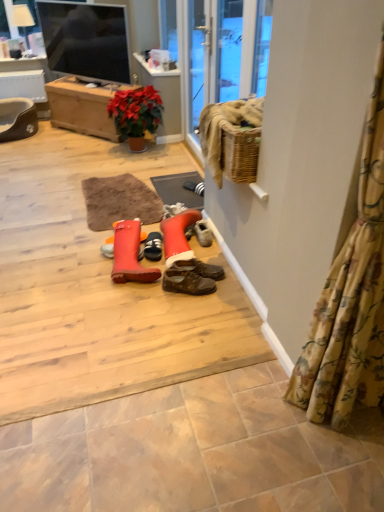
The height and width of the screenshot is (512, 384). In order to click on blank space to the left of rubberized orange boot at center, which is the 1th footwear from left to right in this screenshot , I will do `click(82, 266)`.